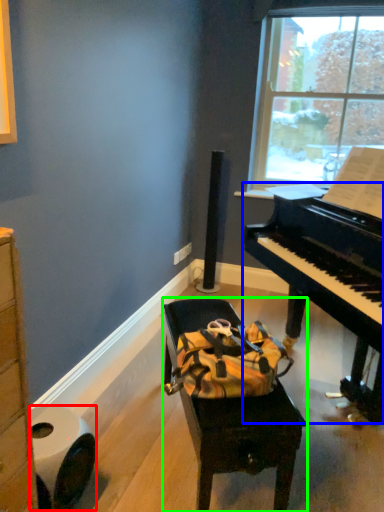
Question: Estimate the real-world distances between objects in this image. Which object is closer to toilet paper (highlighted by a red box), piano (highlighted by a blue box) or furniture (highlighted by a green box)?

Choices:
 (A) piano
 (B) furniture

Answer: (B)